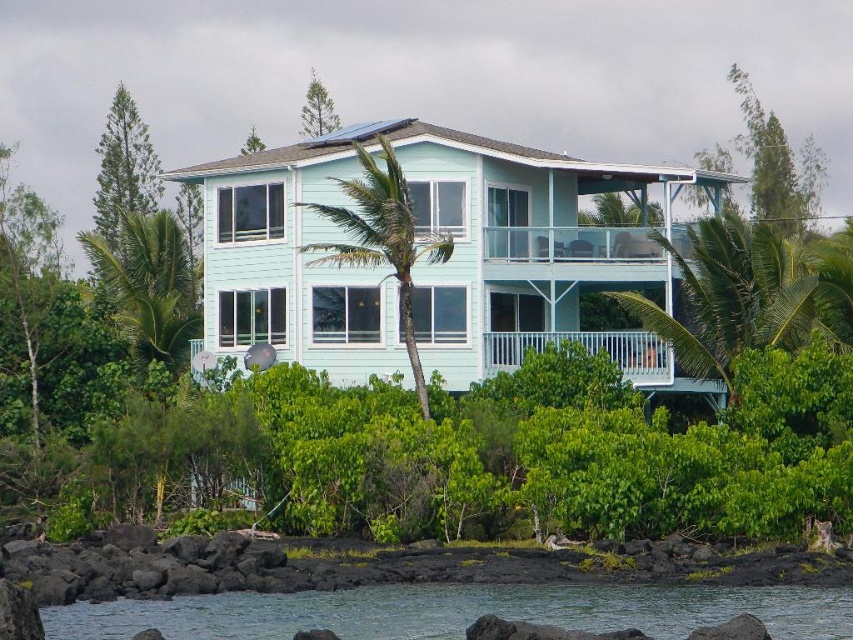
You are standing in front of the two story house and see two points marked on the image. Point A is at coordinates point (184,602) and Point B is at coordinates point (378,244). Which point is closer to you?

Point A at point (184,602) is closer to the viewer than point B at point (378,244).

You are standing in front of the house and want to walk from the clear water at lower center to the green leafy palm tree at right. Which direction should you move?

You should move to the right because the clear water at lower center is to the left of the green leafy palm tree at right, so moving right will take you towards the palm tree.

You are standing at the entrance of the two story house and want to plant a new flower bed. The green leafy palm tree at center is in the way. Where should you move the palm tree to make space for the flower bed?

The green leafy palm tree at center is located at point (381, 237), so you should move it to a different location to create space for the flower bed.